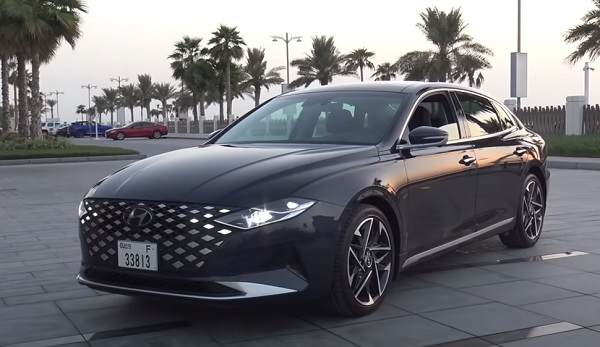
The width and height of the screenshot is (600, 347). I want to click on hood, so click(x=235, y=174).